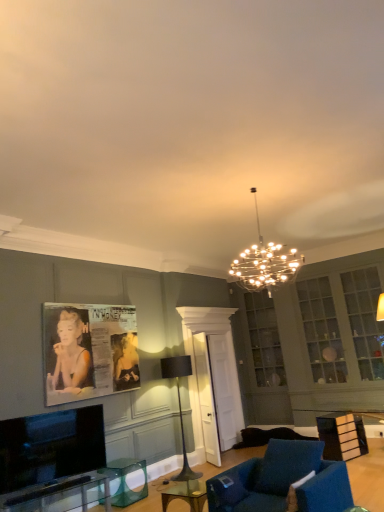
Find the location of a particular element. The height and width of the screenshot is (512, 384). metallic chandelier at center, the 1th lamp from the front is located at coordinates (265, 263).

Describe the element at coordinates (206, 399) in the screenshot. I see `transparent glass door at center` at that location.

Locate an element on the screen. This screenshot has width=384, height=512. clear glass table at center, positioned as the 1th round table in front-to-back order is located at coordinates (186, 494).

Image resolution: width=384 pixels, height=512 pixels. Describe the element at coordinates (186, 494) in the screenshot. I see `clear glass table at center, the second round table when ordered from back to front` at that location.

This screenshot has width=384, height=512. Find the location of `flat screen tv at lower left`. flat screen tv at lower left is located at coordinates (50, 447).

Locate an element on the screen. black glossy poster at left is located at coordinates (88, 351).

From a real-world perspective, is wooden table at lower right, placed as the 2th table when sorted from left to right, below clear glass table at lower left, which is the 1th table in left-to-right order?

No, from a real-world perspective, wooden table at lower right, placed as the 2th table when sorted from left to right, is not below clear glass table at lower left, which is the 1th table in left-to-right order.

Is wooden table at lower right, placed as the 2th table when sorted from left to right, in contact with clear glass table at lower left, the second table from the back?

wooden table at lower right, placed as the 2th table when sorted from left to right, and clear glass table at lower left, the second table from the back, are clearly separated.

At what (x,y) coordinates should I click in order to perform the action: click on table that is on the right side of clear glass table at lower left, which is the 1th table in left-to-right order. Please return your answer as a coordinate pair (x, y). Looking at the image, I should click on (342, 436).

Could you measure the distance between black glossy poster at left and black metal floor lamp at center, the 1th lamp positioned from the back?

black glossy poster at left and black metal floor lamp at center, the 1th lamp positioned from the back, are 1.36 meters apart from each other.

Is black glossy poster at left looking in the opposite direction of black metal floor lamp at center, marked as the 1th lamp in a left-to-right arrangement?

That's not correct — black glossy poster at left is not looking away from black metal floor lamp at center, marked as the 1th lamp in a left-to-right arrangement.

Between black glossy poster at left and black metal floor lamp at center, the 2th lamp viewed from the front, which one is positioned behind?

black metal floor lamp at center, the 2th lamp viewed from the front, is further away from the camera.

Considering the relative sizes of black glossy poster at left and black metal floor lamp at center, the first lamp when ordered from bottom to top, in the image provided, is black glossy poster at left wider than black metal floor lamp at center, the first lamp when ordered from bottom to top,?

In fact, black glossy poster at left might be narrower than black metal floor lamp at center, the first lamp when ordered from bottom to top.

Which is more to the right, transparent glass table at lower center, which ranks as the 2th round table in top-to-bottom order, or black metal floor lamp at center, the first lamp when ordered from bottom to top?

Positioned to the right is black metal floor lamp at center, the first lamp when ordered from bottom to top.

From the image's perspective, would you say transparent glass table at lower center, the first round table in the bottom-to-top sequence, is positioned over black metal floor lamp at center, the first lamp when ordered from bottom to top?

No, from the image's perspective, transparent glass table at lower center, the first round table in the bottom-to-top sequence, is not on top of black metal floor lamp at center, the first lamp when ordered from bottom to top.

From a real-world perspective, is transparent glass table at lower center, the 2th round table in the right-to-left sequence, beneath black metal floor lamp at center, the 1th lamp positioned from the back?

Yes.

Does transparent glass table at lower center, the first round table in the bottom-to-top sequence, lie behind black metal floor lamp at center, the 2th lamp viewed from the front?

No, transparent glass table at lower center, the first round table in the bottom-to-top sequence, is closer to the camera.

Between clear glass table at center, positioned as the 1th round table in front-to-back order, and metallic chandelier at center, which is counted as the second lamp, starting from the left, which one has smaller width?

Thinner between the two is clear glass table at center, positioned as the 1th round table in front-to-back order.

Which object is closer to the camera taking this photo, clear glass table at center, which is the second round table in left-to-right order, or metallic chandelier at center, which is counted as the second lamp, starting from the left?

clear glass table at center, which is the second round table in left-to-right order, is more forward.

From the image's perspective, is clear glass table at center, placed as the 1th round table when sorted from right to left, below metallic chandelier at center, placed as the 1th lamp when sorted from right to left?

Yes, from the image's perspective, clear glass table at center, placed as the 1th round table when sorted from right to left, is below metallic chandelier at center, placed as the 1th lamp when sorted from right to left.

Which is farther, (162, 503) or (258, 237)?

The point (258, 237) is farther from the camera.

Considering the relative sizes of black metal floor lamp at center, marked as the 1th lamp in a left-to-right arrangement, and metallic chandelier at center, placed as the 1th lamp when sorted from right to left, in the image provided, is black metal floor lamp at center, marked as the 1th lamp in a left-to-right arrangement, wider than metallic chandelier at center, placed as the 1th lamp when sorted from right to left,?

Incorrect, the width of black metal floor lamp at center, marked as the 1th lamp in a left-to-right arrangement, does not surpass that of metallic chandelier at center, placed as the 1th lamp when sorted from right to left.

From the image's perspective, is black metal floor lamp at center, the 2th lamp viewed from the front, on metallic chandelier at center, placed as the 1th lamp when sorted from right to left?

No, from the image's perspective, black metal floor lamp at center, the 2th lamp viewed from the front, is not on top of metallic chandelier at center, placed as the 1th lamp when sorted from right to left.

Is metallic chandelier at center, placed as the 1th lamp when sorted from right to left, at the back of black metal floor lamp at center, the 2th lamp positioned from the right?

No, black metal floor lamp at center, the 2th lamp positioned from the right, is not facing the opposite direction of metallic chandelier at center, placed as the 1th lamp when sorted from right to left.

Is black metal floor lamp at center, the first lamp when ordered from bottom to top, in front of metallic chandelier at center, which is counted as the second lamp, starting from the left?

No.

Considering the positions of point (19, 419) and point (203, 426), is point (19, 419) closer or farther from the camera than point (203, 426)?

Point (19, 419).

Is flat screen tv at lower left aimed at transparent glass door at center?

No, flat screen tv at lower left is not aimed at transparent glass door at center.

Where is `glass door on the right of flat screen tv at lower left`? glass door on the right of flat screen tv at lower left is located at coordinates (206, 399).

Which of these two, flat screen tv at lower left or transparent glass door at center, is bigger?

transparent glass door at center is bigger.

Is flat screen tv at lower left wider than velvet blue armchair at lower center?

No.

In terms of height, does flat screen tv at lower left look taller or shorter compared to velvet blue armchair at lower center?

Clearly, flat screen tv at lower left is taller compared to velvet blue armchair at lower center.

Which is more to the right, flat screen tv at lower left or velvet blue armchair at lower center?

velvet blue armchair at lower center is more to the right.

From the image's perspective, is flat screen tv at lower left above or below velvet blue armchair at lower center?

Based on their image positions, flat screen tv at lower left is located above velvet blue armchair at lower center.

Where is `table behind the clear glass table at lower left, the 2th table positioned from the right`? The width and height of the screenshot is (384, 512). table behind the clear glass table at lower left, the 2th table positioned from the right is located at coordinates point(342,436).

The image size is (384, 512). In order to click on lamp directly beneath the black glossy poster at left (from a real-world perspective) in this screenshot , I will do `click(180, 406)`.

From the image, which object appears to be nearer to wooden table at lower right, the 1th table from the back, clear glass table at lower left, the second table from the back, or transparent glass door at center?

Based on the image, transparent glass door at center appears to be nearer to wooden table at lower right, the 1th table from the back.

Estimate the real-world distances between objects in this image. Which object is closer to clear glass table at center, acting as the 2th round table starting from the bottom, black metal floor lamp at center, marked as the 1th lamp in a left-to-right arrangement, or clear glass table at lower left, the 2th table positioned from the right?

clear glass table at lower left, the 2th table positioned from the right, is closer to clear glass table at center, acting as the 2th round table starting from the bottom.

Estimate the real-world distances between objects in this image. Which object is closer to velvet blue armchair at lower center, clear glass table at center, acting as the 2th round table starting from the bottom, or transparent glass table at lower center, positioned as the second round table in front-to-back order?

The object closer to velvet blue armchair at lower center is clear glass table at center, acting as the 2th round table starting from the bottom.

When comparing their distances from transparent glass door at center, does black glossy poster at left or velvet blue armchair at lower center seem closer?

black glossy poster at left is positioned closer to the anchor transparent glass door at center.

From the image, which object appears to be nearer to transparent glass door at center, wooden table at lower right, the 2th table viewed from the front, or clear glass table at center, which is the second round table in left-to-right order?

Among the two, clear glass table at center, which is the second round table in left-to-right order, is located nearer to transparent glass door at center.

Which object lies nearer to the anchor point transparent glass door at center, transparent glass table at lower center, the 2th round table in the right-to-left sequence, or black glossy poster at left?

transparent glass table at lower center, the 2th round table in the right-to-left sequence, is closer to transparent glass door at center.

Considering their positions, is clear glass table at lower left, the 2th table positioned from the right, positioned closer to clear glass table at center, which is the second round table in left-to-right order, than black metal floor lamp at center, the 1th lamp positioned from the back?

clear glass table at lower left, the 2th table positioned from the right.

Considering their positions, is transparent glass table at lower center, positioned as the second round table in front-to-back order, positioned closer to flat screen tv at lower left than metallic chandelier at center, the 1th lamp from the front?

transparent glass table at lower center, positioned as the second round table in front-to-back order.

Where is `picture frame between flat screen tv at lower left and black metal floor lamp at center, the 2th lamp positioned from the right, in the front-back direction`? The height and width of the screenshot is (512, 384). picture frame between flat screen tv at lower left and black metal floor lamp at center, the 2th lamp positioned from the right, in the front-back direction is located at coordinates coord(88,351).

I want to click on chair that lies between metallic chandelier at center, arranged as the 2th lamp when ordered from the bottom, and clear glass table at center, placed as the 1th round table when sorted from right to left, from top to bottom, so click(282, 481).

Locate an element on the screen. picture frame between metallic chandelier at center, arranged as the 2th lamp when ordered from the bottom, and clear glass table at center, which is the second round table in left-to-right order, vertically is located at coordinates (88, 351).

Where is `glass door between flat screen tv at lower left and wooden table at lower right, placed as the first table when sorted from right to left`? The image size is (384, 512). glass door between flat screen tv at lower left and wooden table at lower right, placed as the first table when sorted from right to left is located at coordinates (206, 399).